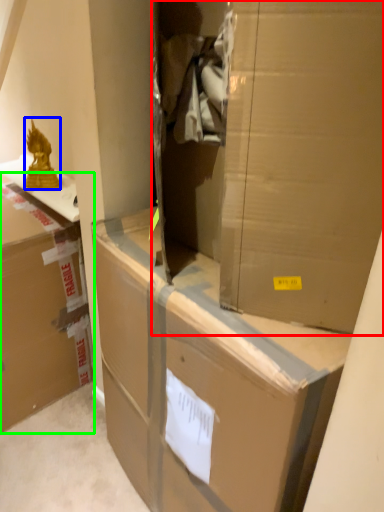
Question: Which is nearer to the cardboard box (highlighted by a red box)? wrap (highlighted by a blue box) or box (highlighted by a green box).

Choices:
 (A) wrap
 (B) box

Answer: (B)